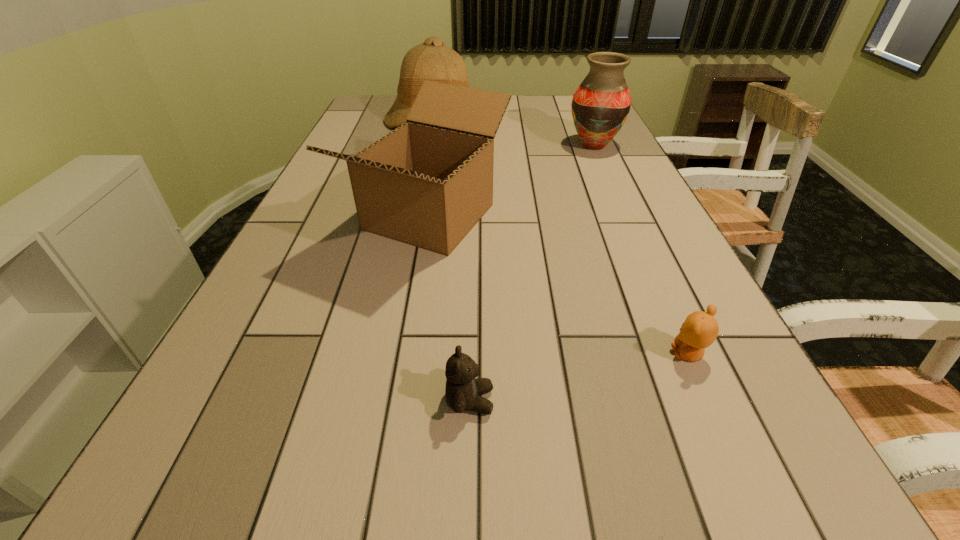
In the image, there is a desktop. At what (x,y) coordinates should I click in order to perform the action: click on vacant space at the far edge. Please return your answer as a coordinate pair (x, y). Image resolution: width=960 pixels, height=540 pixels. Looking at the image, I should click on (514, 110).

Identify the location of vacant space at the left edge. (293, 244).

Where is `vacant space at the right edge`? vacant space at the right edge is located at coordinates (725, 319).

I want to click on free space at the far left corner of the desktop, so click(364, 116).

Locate an element on the screen. Image resolution: width=960 pixels, height=540 pixels. vacant area at the far right corner is located at coordinates (571, 113).

Locate an element on the screen. free spot between the second nearest object and the box is located at coordinates (559, 286).

The image size is (960, 540). Identify the location of free space between the nearest object and the right teddy bear. (579, 377).

Where is `free spot between the nearer teddy bear and the hat`? Image resolution: width=960 pixels, height=540 pixels. free spot between the nearer teddy bear and the hat is located at coordinates (451, 260).

Identify the location of free space between the right teddy bear and the nearer teddy bear. (579, 377).

Where is `empty location between the hat and the left teddy bear`? empty location between the hat and the left teddy bear is located at coordinates [x=451, y=260].